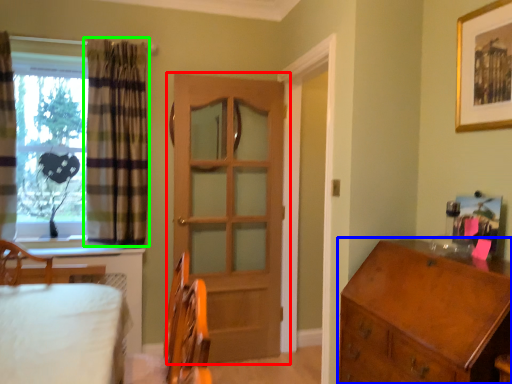
Question: Which object is positioned closest to door (highlighted by a red box)? Select from chest of drawers (highlighted by a blue box) and curtain (highlighted by a green box).

Choices:
 (A) chest of drawers
 (B) curtain

Answer: (B)